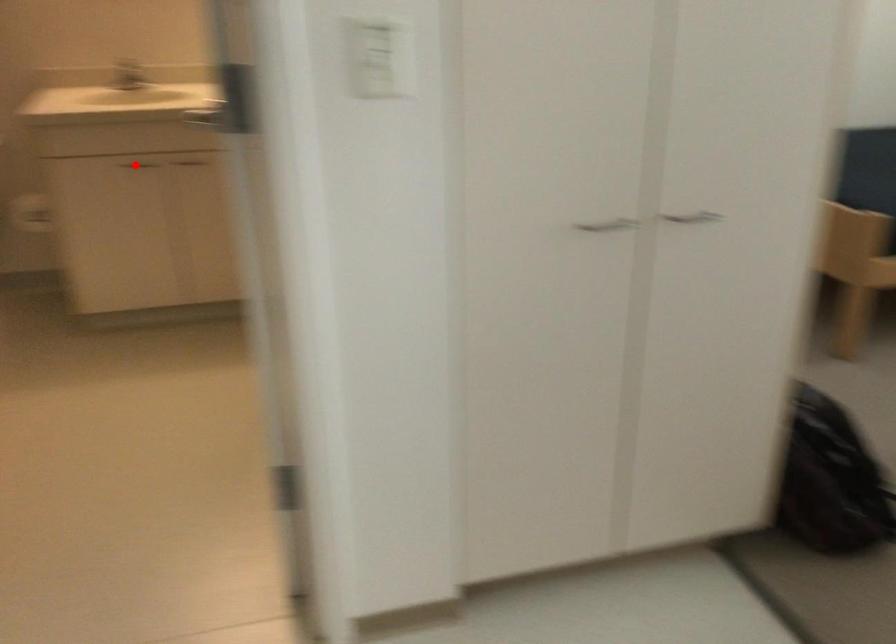
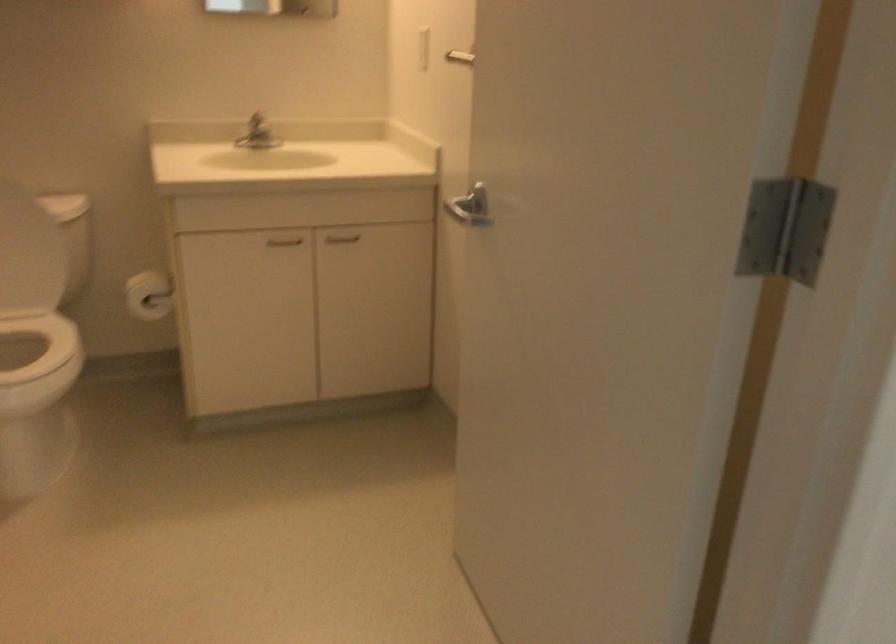
Locate, in the second image, the point that corresponds to the highlighted location in the first image.

(283, 241)